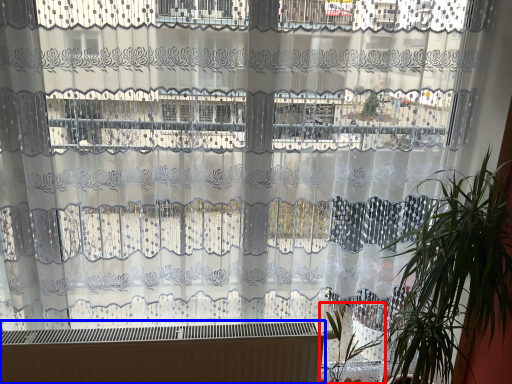
Question: Which of the following is the farthest to the observer, vegetation (highlighted by a red box) or heater (highlighted by a blue box)?

Choices:
 (A) vegetation
 (B) heater

Answer: (B)